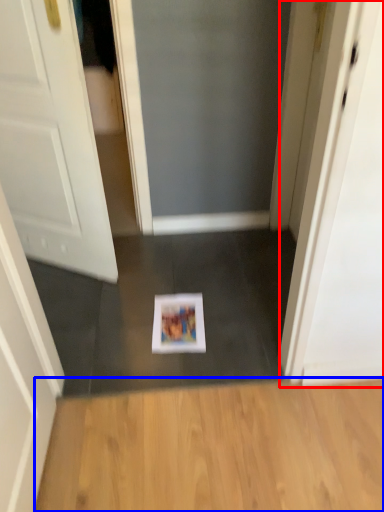
Question: Which object appears closest to the camera in this image, screen door (highlighted by a red box) or hardwood (highlighted by a blue box)?

Choices:
 (A) screen door
 (B) hardwood

Answer: (B)